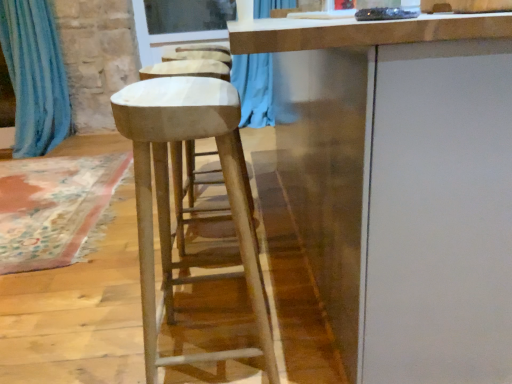
Identify the location of free point to the right of smooth white stool at center. This screenshot has width=512, height=384. (304, 337).